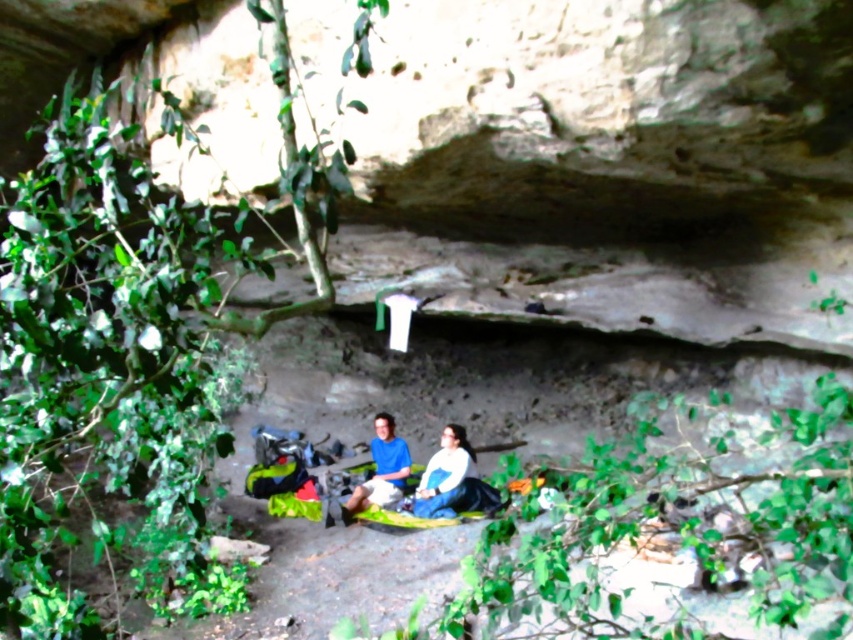
Question: Which point is farther to the camera?

Choices:
 (A) (467, 461)
 (B) (358, 506)

Answer: (A)

Question: Is white matte jacket at center closer to camera compared to matte blue shirt at center?

Choices:
 (A) yes
 (B) no

Answer: (B)

Question: Among these objects, which one is nearest to the camera?

Choices:
 (A) white matte jacket at center
 (B) matte blue shirt at center

Answer: (B)

Question: Which object appears closest to the camera in this image?

Choices:
 (A) white matte jacket at center
 (B) matte blue shirt at center

Answer: (B)

Question: Is white matte jacket at center positioned at the back of matte blue shirt at center?

Choices:
 (A) yes
 (B) no

Answer: (A)

Question: In this image, where is white matte jacket at center located relative to matte blue shirt at center?

Choices:
 (A) right
 (B) left

Answer: (A)